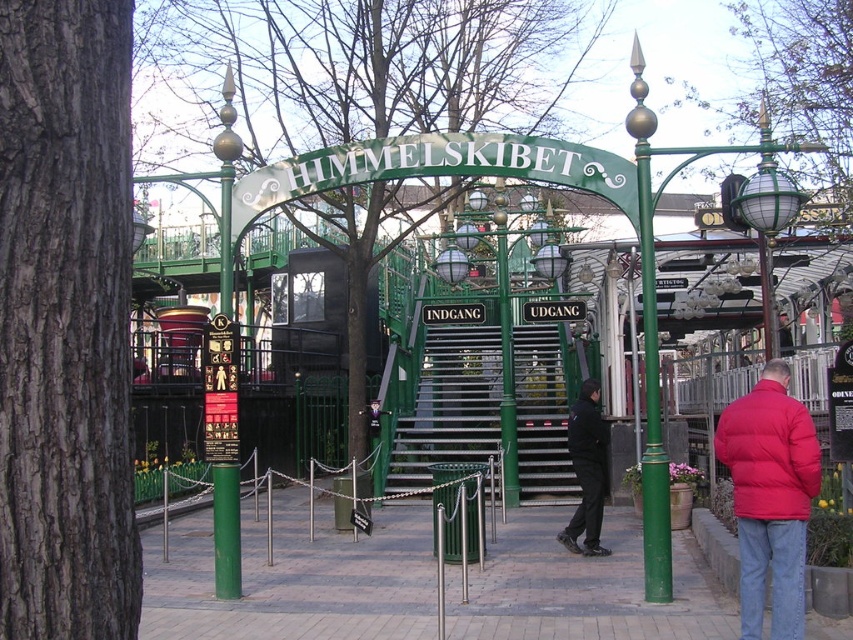
Question: Which point appears closest to the camera in this image?

Choices:
 (A) (569, 529)
 (B) (799, 502)
 (C) (222, 548)

Answer: (B)

Question: Can you confirm if green metallic stairs at center is bigger than green polished metal pole at center-left?

Choices:
 (A) no
 (B) yes

Answer: (B)

Question: Which point appears farthest from the camera in this image?

Choices:
 (A) (219, 532)
 (B) (569, 451)
 (C) (756, 513)
 (D) (578, 378)

Answer: (D)

Question: Is the position of green metallic stairs at center less distant than that of green polished metal pole at center-left?

Choices:
 (A) yes
 (B) no

Answer: (B)

Question: Is green metallic stairs at center positioned at the back of dark blue jacket at center?

Choices:
 (A) no
 (B) yes

Answer: (B)

Question: Which object appears closest to the camera in this image?

Choices:
 (A) green metallic stairs at center
 (B) red puffy jacket at lower right

Answer: (B)